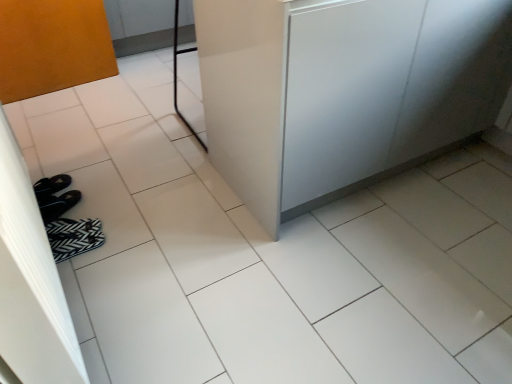
Question: Is satin white counter at center positioned in front of matte orange screen door at left?

Choices:
 (A) no
 (B) yes

Answer: (A)

Question: Is there a large distance between satin white counter at center and matte orange screen door at left?

Choices:
 (A) no
 (B) yes

Answer: (B)

Question: From a real-world perspective, is satin white counter at center physically below matte orange screen door at left?

Choices:
 (A) no
 (B) yes

Answer: (A)

Question: Is satin white counter at center further to the viewer compared to matte orange screen door at left?

Choices:
 (A) no
 (B) yes

Answer: (B)

Question: From a real-world perspective, is satin white counter at center physically above matte orange screen door at left?

Choices:
 (A) yes
 (B) no

Answer: (A)

Question: Is point (361, 130) positioned closer to the camera than point (54, 365)?

Choices:
 (A) closer
 (B) farther

Answer: (B)

Question: Is satin white counter at center inside or outside of matte orange screen door at left?

Choices:
 (A) outside
 (B) inside

Answer: (A)

Question: Is satin white counter at center in front of or behind matte orange screen door at left in the image?

Choices:
 (A) front
 (B) behind

Answer: (B)

Question: From the image's perspective, relative to matte orange screen door at left, is satin white counter at center above or below?

Choices:
 (A) above
 (B) below

Answer: (A)

Question: Is matte orange screen door at left taller or shorter than satin white counter at center?

Choices:
 (A) tall
 (B) short

Answer: (B)

Question: Is point pos(72,362) positioned closer to the camera than point pos(358,152)?

Choices:
 (A) closer
 (B) farther

Answer: (A)

Question: Relative to satin white counter at center, is matte orange screen door at left in front or behind?

Choices:
 (A) front
 (B) behind

Answer: (A)

Question: Looking at the image, does matte orange screen door at left seem bigger or smaller compared to satin white counter at center?

Choices:
 (A) small
 (B) big

Answer: (A)

Question: Is matte orange screen door at left to the left or to the right of black fabric flip-flops at lower left in the image?

Choices:
 (A) right
 (B) left

Answer: (B)

Question: From a real-world perspective, is matte orange screen door at left positioned above or below black fabric flip-flops at lower left?

Choices:
 (A) below
 (B) above

Answer: (B)